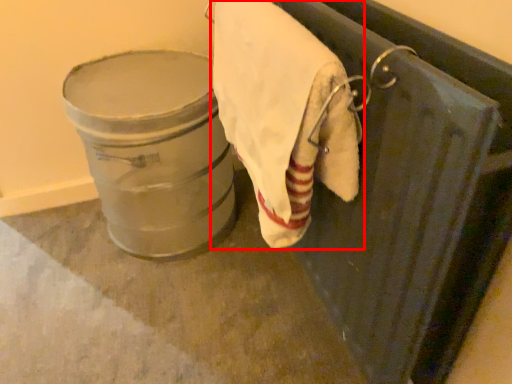
Question: From the image's perspective, what is the correct spatial relationship of towel (annotated by the red box) in relation to lift?

Choices:
 (A) above
 (B) below

Answer: (A)